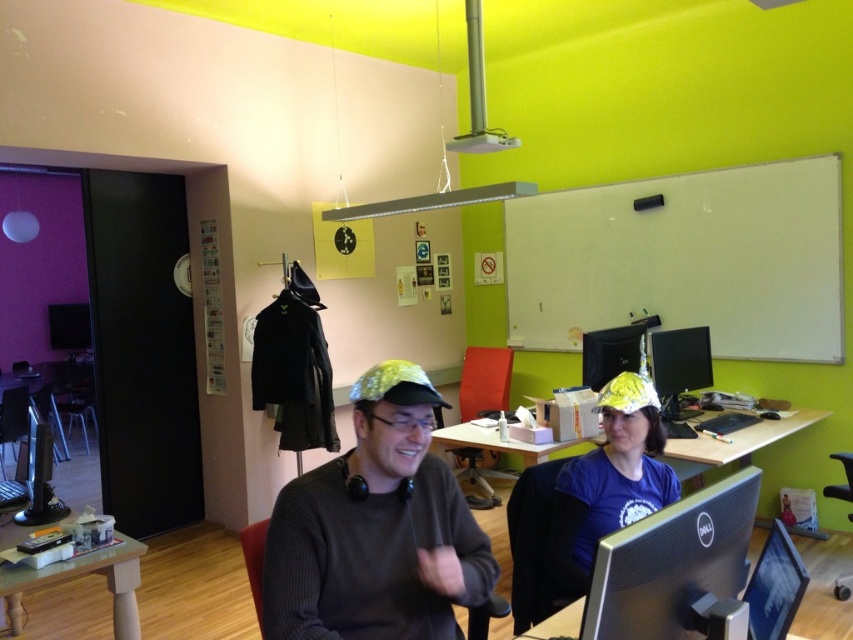
Based on the scene description, if you are facing the desk where the two people are sitting, which object is positioned to the left of the other between the black glossy monitor at center and the blue fabric hat at center?

The black glossy monitor at center is positioned to the left of the blue fabric hat at center.

You are a delivery robot entering the workspace and need to place a package on the wooden table at lower left. However, there is a blue fabric hat at center in the way. Can you place the package on the table without moving the hat?

The blue fabric hat at center is above the wooden table at lower left, so it is blocking access to the table. You cannot place the package on the table without moving the hat.

You are setting up a new monitor in this office. The black glossy monitor at center is currently placed between the two people. If you want to ensure the blue fabric hat at center doesn not block the view of the monitor, which object should be moved and why?

The blue fabric hat at center should be moved because the black glossy monitor at center is shorter than the blue fabric hat at center, so the hat could block the view. Lowering or moving the hat would ensure the monitor remains visible.